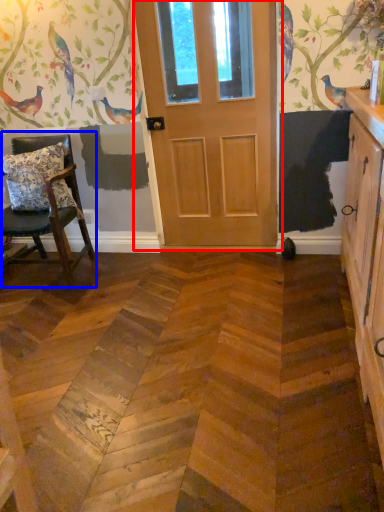
Question: Which of the following is the farthest to the observer, door (highlighted by a red box) or chair (highlighted by a blue box)?

Choices:
 (A) door
 (B) chair

Answer: (A)